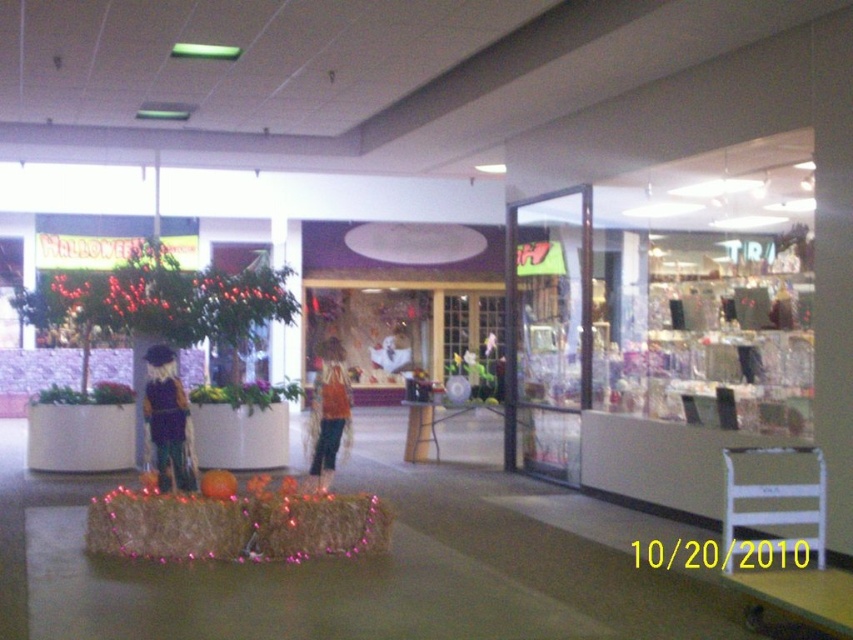
You are a customer standing in front of the Halloween display at the mall. You want to pick up the orange fabric dress at center but need to avoid bumping into the matte brown scarecrow at center. Can you reach the dress without moving the scarecrow?

The matte brown scarecrow at center is closer to the viewer than the orange fabric dress at center, so you would have to go around or move the scarecrow to reach the dress.

You are standing at the camera position and want to take a photo of the matte brown scarecrow at center. If your camera has a maximum focus range of 7 meters, will you be able to capture the scarecrow clearly?

The matte brown scarecrow at center and camera are 7.55 meters apart from each other, which exceeds the camera maximum focus range of 7 meters. Therefore, you won not be able to capture the scarecrow clearly.

You are a customer in the mall and want to take a photo of both the matte brown scarecrow at center and the orange fabric dress at center. Which object should you focus on first if you want to ensure both are in the frame without moving the camera?

You should focus on the matte brown scarecrow at center first because it is shorter than the orange fabric dress at center. By centering the camera on the shorter scarecrow, you can adjust the frame to include both objects without needing to move the camera position.